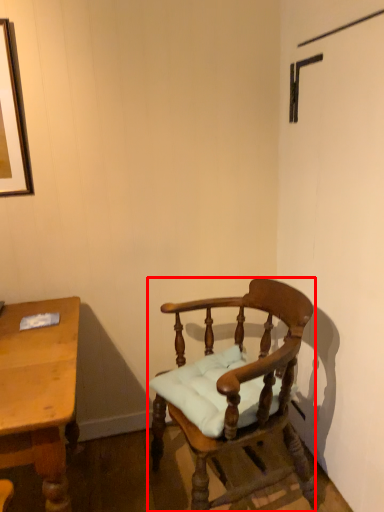
Question: From the image, what is the correct spatial relationship of chair (annotated by the red box) in relation to desk?

Choices:
 (A) right
 (B) left

Answer: (A)